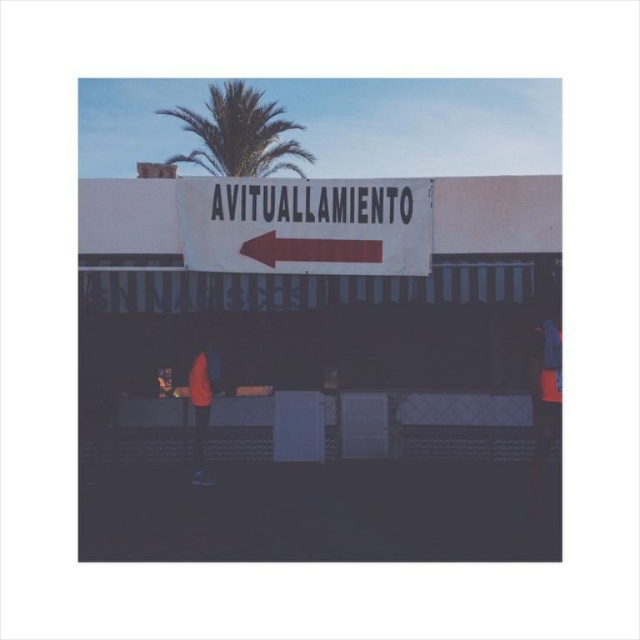
You are standing at the point marked as point (240, 132) in the image. What object is located exactly at that point?

The green leafy palm tree at upper center is located exactly at point (240, 132).

You are standing at the base of the green leafy palm tree at upper center. Looking up, you notice a signboard with an arrow pointing to the left. Based on the signboard and your position, which direction would the arrow indicate you to go relative to the palm tree?

The arrow on the signboard points to the left, so relative to the green leafy palm tree at upper center, you should go to the left side of the palm tree.